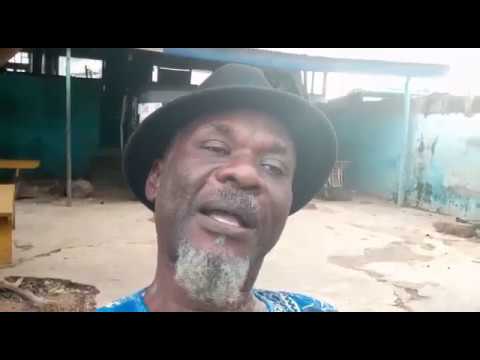
At what (x,y) coordinates should I click in order to perform the action: click on floor. Please return your answer as a coordinate pair (x, y). Looking at the image, I should click on (117, 231).